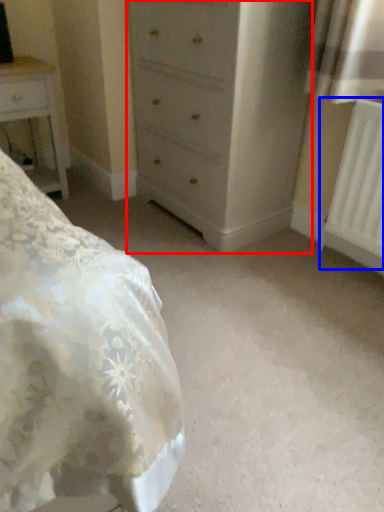
Question: Which object is further to the camera taking this photo, chest of drawers (highlighted by a red box) or radiator (highlighted by a blue box)?

Choices:
 (A) chest of drawers
 (B) radiator

Answer: (A)